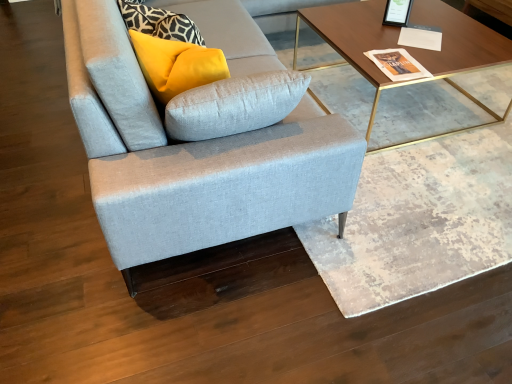
Question: Does matte yellow pillow at upper left have a smaller size compared to light gray fabric couch at center?

Choices:
 (A) yes
 (B) no

Answer: (A)

Question: Is matte yellow pillow at upper left placed right next to light gray fabric couch at center?

Choices:
 (A) yes
 (B) no

Answer: (B)

Question: Is matte yellow pillow at upper left positioned behind light gray fabric couch at center?

Choices:
 (A) no
 (B) yes

Answer: (B)

Question: Is matte yellow pillow at upper left far from light gray fabric couch at center?

Choices:
 (A) no
 (B) yes

Answer: (A)

Question: Is matte yellow pillow at upper left in front of light gray fabric couch at center?

Choices:
 (A) yes
 (B) no

Answer: (B)

Question: Relative to light gray fabric couch at center, is matte yellow pillow at upper left in front or behind?

Choices:
 (A) front
 (B) behind

Answer: (B)

Question: Considering the positions of matte yellow pillow at upper left and light gray fabric couch at center in the image, is matte yellow pillow at upper left wider or thinner than light gray fabric couch at center?

Choices:
 (A) wide
 (B) thin

Answer: (B)

Question: Is matte yellow pillow at upper left to the left or to the right of light gray fabric couch at center in the image?

Choices:
 (A) right
 (B) left

Answer: (B)

Question: Considering the positions of matte yellow pillow at upper left and light gray fabric couch at center in the image, is matte yellow pillow at upper left bigger or smaller than light gray fabric couch at center?

Choices:
 (A) small
 (B) big

Answer: (A)

Question: Considering the positions of light gray fabric couch at center and wooden/golden metal legs coffee table at upper right in the image, is light gray fabric couch at center taller or shorter than wooden/golden metal legs coffee table at upper right?

Choices:
 (A) short
 (B) tall

Answer: (B)

Question: Considering their positions, is light gray fabric couch at center located in front of or behind wooden/golden metal legs coffee table at upper right?

Choices:
 (A) behind
 (B) front

Answer: (B)

Question: From a real-world perspective, is light gray fabric couch at center above or below wooden/golden metal legs coffee table at upper right?

Choices:
 (A) below
 (B) above

Answer: (B)

Question: In terms of width, does light gray fabric couch at center look wider or thinner when compared to wooden/golden metal legs coffee table at upper right?

Choices:
 (A) thin
 (B) wide

Answer: (B)

Question: In terms of height, does matte yellow pillow at upper left look taller or shorter compared to wooden/golden metal legs coffee table at upper right?

Choices:
 (A) tall
 (B) short

Answer: (A)

Question: Considering the positions of matte yellow pillow at upper left and wooden/golden metal legs coffee table at upper right in the image, is matte yellow pillow at upper left wider or thinner than wooden/golden metal legs coffee table at upper right?

Choices:
 (A) thin
 (B) wide

Answer: (A)